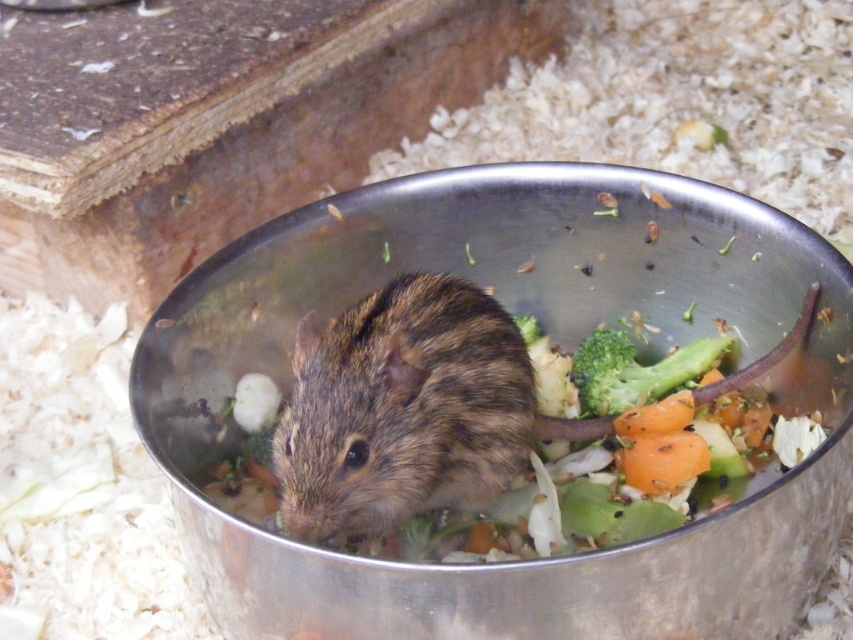
Does green matte broccoli at center have a smaller size compared to orange matte carrot at center?

Incorrect, green matte broccoli at center is not smaller in size than orange matte carrot at center.

Which is more to the right, green matte broccoli at center or orange matte carrot at center?

green matte broccoli at center is more to the right.

At what (x,y) coordinates should I click in order to perform the action: click on green matte broccoli at center. Please return your answer as a coordinate pair (x, y). This screenshot has width=853, height=640. Looking at the image, I should click on (636, 371).

You are a GUI agent. You are given a task and a screenshot of the screen. Output one action in this format:
    pyautogui.click(x=<x>, y=<y>)
    Task: Click on the green matte broccoli at center
    The image size is (853, 640).
    Given the screenshot: What is the action you would take?
    pyautogui.click(x=636, y=371)

Locate an element on the screen. This screenshot has height=640, width=853. brown fuzzy mouse at center is located at coordinates (407, 410).

Between brown fuzzy mouse at center and orange matte carrot at center, which one is positioned lower?

Positioned lower is orange matte carrot at center.

The image size is (853, 640). I want to click on brown fuzzy mouse at center, so coord(407,410).

Is metallic silver bowl at center further to camera compared to brown fuzzy mouse at center?

That is False.

Which is below, metallic silver bowl at center or brown fuzzy mouse at center?

Positioned lower is brown fuzzy mouse at center.

Is point (662, 237) more distant than point (338, 461)?

Yes, it is.

Identify the location of metallic silver bowl at center. The height and width of the screenshot is (640, 853). (558, 344).